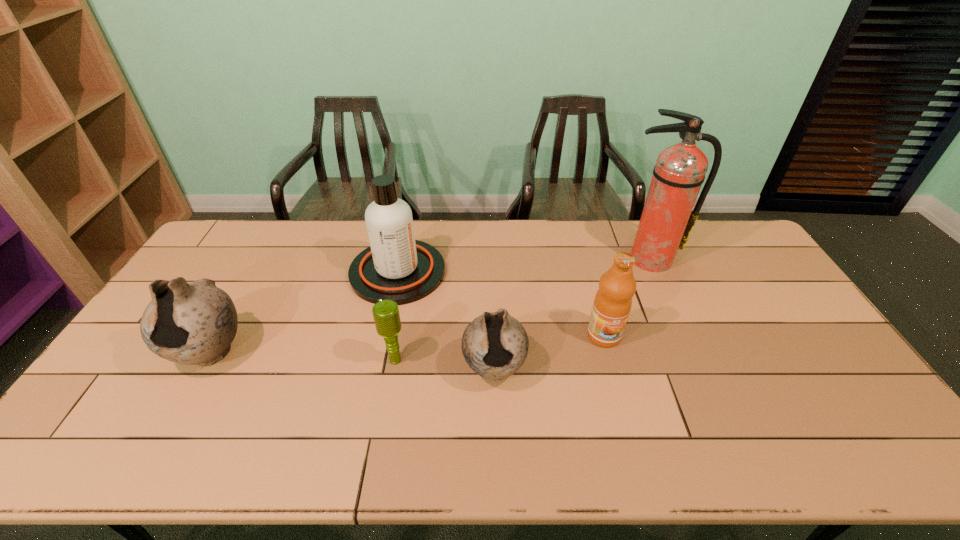
Find the location of `the left pottery`. the left pottery is located at coordinates (192, 323).

At what (x,y) coordinates should I click in order to perform the action: click on the leftmost object. Please return your answer as a coordinate pair (x, y). Looking at the image, I should click on (192, 323).

This screenshot has width=960, height=540. I want to click on the right pottery, so click(495, 345).

Identify the location of the third object from right to left. This screenshot has width=960, height=540. (495, 345).

Locate an element on the screen. Image resolution: width=960 pixels, height=540 pixels. the fifth object from left to right is located at coordinates (612, 303).

At what (x,y) coordinates should I click in order to perform the action: click on cleansing agent. Please return your answer as a coordinate pair (x, y). This screenshot has width=960, height=540. Looking at the image, I should click on point(397,267).

Image resolution: width=960 pixels, height=540 pixels. Identify the location of the tallest object. (667, 220).

Locate an element on the screen. This screenshot has width=960, height=540. the rightmost object is located at coordinates (x=667, y=220).

The image size is (960, 540). I want to click on microphone, so click(x=386, y=315).

You are a GUI agent. You are given a task and a screenshot of the screen. Output one action in this format:
    pyautogui.click(x=<x>, y=<y>)
    Task: Click on the vacant point located from the spout of the left pottery
    
    Given the screenshot: What is the action you would take?
    pyautogui.click(x=182, y=402)